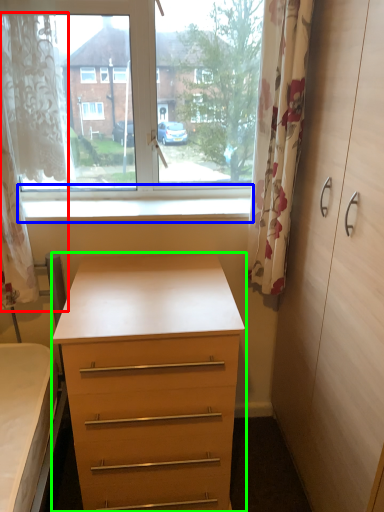
Question: Considering the real-world distances, which object is closest to curtain (highlighted by a red box)? window sill (highlighted by a blue box) or chest of drawers (highlighted by a green box).

Choices:
 (A) window sill
 (B) chest of drawers

Answer: (A)